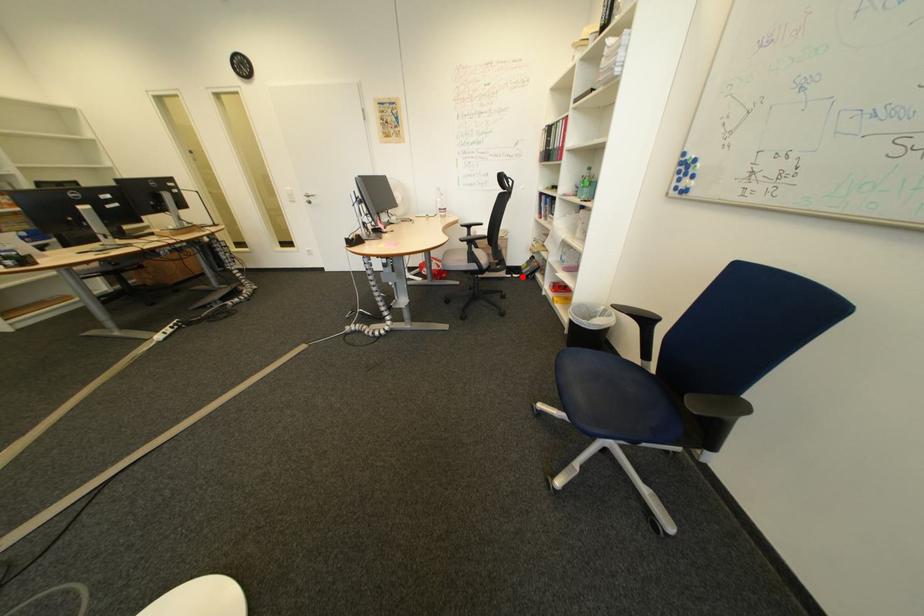
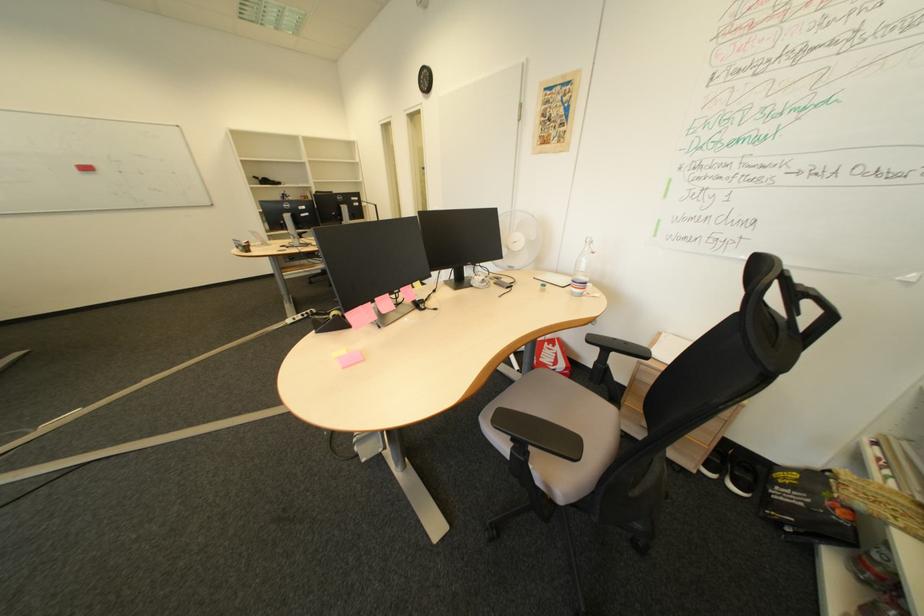
Find the pixel in the second image that matches the highlighted location in the first image.

(724, 477)